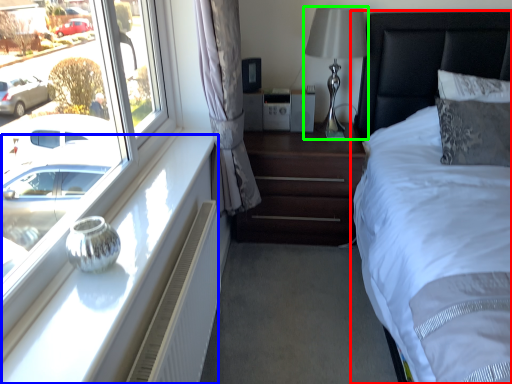
Question: Estimate the real-world distances between objects in this image. Which object is farther from bed (highlighted by a red box), window sill (highlighted by a blue box) or bedside lamp (highlighted by a green box)?

Choices:
 (A) window sill
 (B) bedside lamp

Answer: (A)